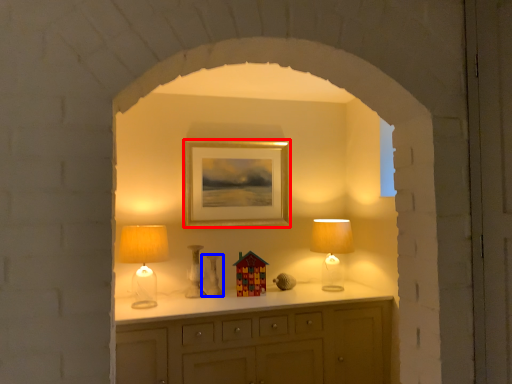
Question: Which object is further to the camera taking this photo, picture frame (highlighted by a red box) or vase (highlighted by a blue box)?

Choices:
 (A) picture frame
 (B) vase

Answer: (A)